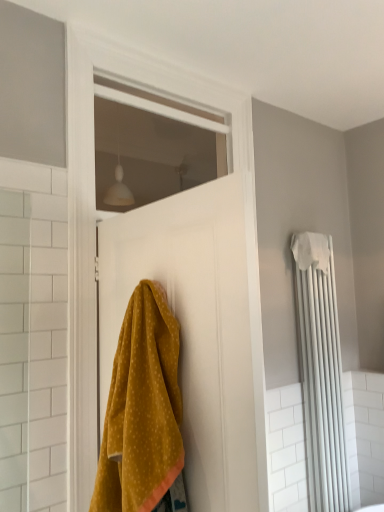
Question: From the image's perspective, is mustard yellow fabric at center beneath white glass window at upper center?

Choices:
 (A) yes
 (B) no

Answer: (A)

Question: From a real-world perspective, is mustard yellow fabric at center located higher than white glass window at upper center?

Choices:
 (A) yes
 (B) no

Answer: (B)

Question: Is mustard yellow fabric at center far from white glass window at upper center?

Choices:
 (A) yes
 (B) no

Answer: (A)

Question: Is mustard yellow fabric at center to the left of white glass window at upper center from the viewer's perspective?

Choices:
 (A) yes
 (B) no

Answer: (A)

Question: Considering the relative sizes of mustard yellow fabric at center and white glass window at upper center in the image provided, is mustard yellow fabric at center smaller than white glass window at upper center?

Choices:
 (A) yes
 (B) no

Answer: (B)

Question: Can you confirm if mustard yellow fabric at center is shorter than white glass window at upper center?

Choices:
 (A) no
 (B) yes

Answer: (A)

Question: Can you confirm if white fabric bath towel at right is positioned to the right of white matte door at center?

Choices:
 (A) yes
 (B) no

Answer: (A)

Question: Is white fabric bath towel at right further to the viewer compared to white matte door at center?

Choices:
 (A) no
 (B) yes

Answer: (B)

Question: Is white fabric bath towel at right in front of white matte door at center?

Choices:
 (A) yes
 (B) no

Answer: (B)

Question: Does white fabric bath towel at right have a smaller size compared to white matte door at center?

Choices:
 (A) no
 (B) yes

Answer: (B)

Question: Is white fabric bath towel at right surrounding white matte door at center?

Choices:
 (A) yes
 (B) no

Answer: (B)

Question: Does white fabric bath towel at right have a lesser width compared to white matte door at center?

Choices:
 (A) yes
 (B) no

Answer: (B)

Question: From a real-world perspective, is white matte door at center positioned over white matte radiator at right based on gravity?

Choices:
 (A) no
 (B) yes

Answer: (B)